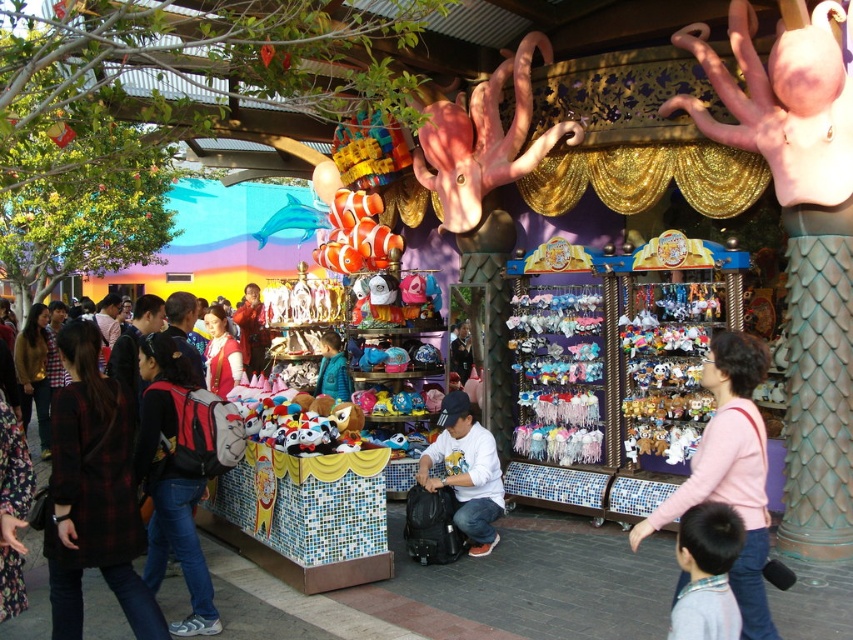
Which is more to the left, black plaid coat at center left or pink fabric shirt at center?

black plaid coat at center left is more to the left.

Between black plaid coat at center left and pink fabric shirt at center, which one has less height?

With less height is pink fabric shirt at center.

Which is in front, point (120, 436) or point (763, 358)?

Positioned in front is point (763, 358).

Where is `black plaid coat at center left`? This screenshot has width=853, height=640. black plaid coat at center left is located at coordinates (93, 492).

Can you confirm if pink fabric shirt at center is positioned to the left of white matte shirt at center?

In fact, pink fabric shirt at center is to the right of white matte shirt at center.

Where is `pink fabric shirt at center`? The image size is (853, 640). pink fabric shirt at center is located at coordinates point(730,470).

Locate an element on the screen. Image resolution: width=853 pixels, height=640 pixels. pink fabric shirt at center is located at coordinates (730, 470).

Does plaid fabric jacket at left come behind red backpack at left?

No, it is not.

Which is above, plaid fabric jacket at left or red backpack at left?

Positioned higher is plaid fabric jacket at left.

Does point (126, 499) lie behind point (196, 483)?

No, (126, 499) is in front of (196, 483).

This screenshot has height=640, width=853. Find the location of `plaid fabric jacket at left`. plaid fabric jacket at left is located at coordinates (102, 500).